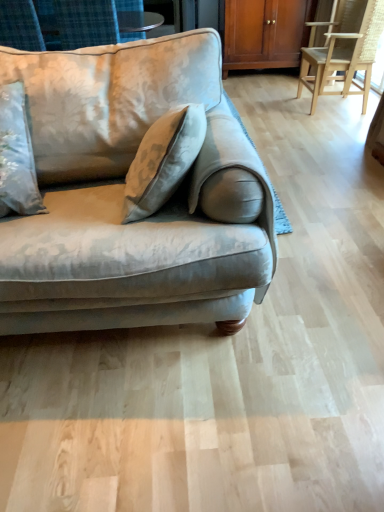
The image size is (384, 512). Find the location of `vacant region to the right of velvet beige couch at left`. vacant region to the right of velvet beige couch at left is located at coordinates (319, 267).